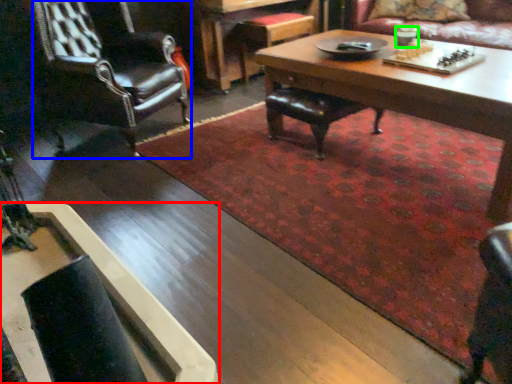
Question: Considering the real-world distances, which object is closest to coffee table (highlighted by a red box)? chair (highlighted by a blue box) or coffee cup (highlighted by a green box).

Choices:
 (A) chair
 (B) coffee cup

Answer: (A)